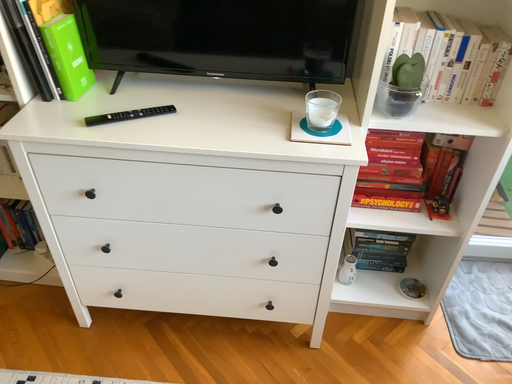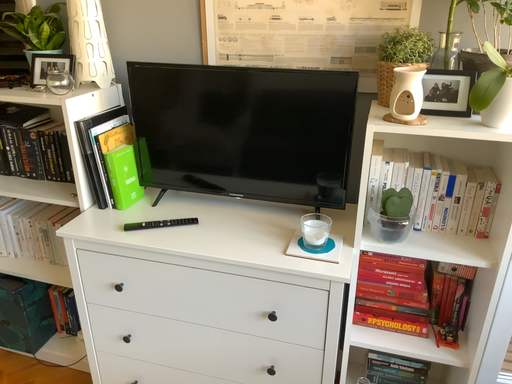
Question: How did the camera likely rotate when shooting the video?

Choices:
 (A) rotated left
 (B) rotated right

Answer: (A)